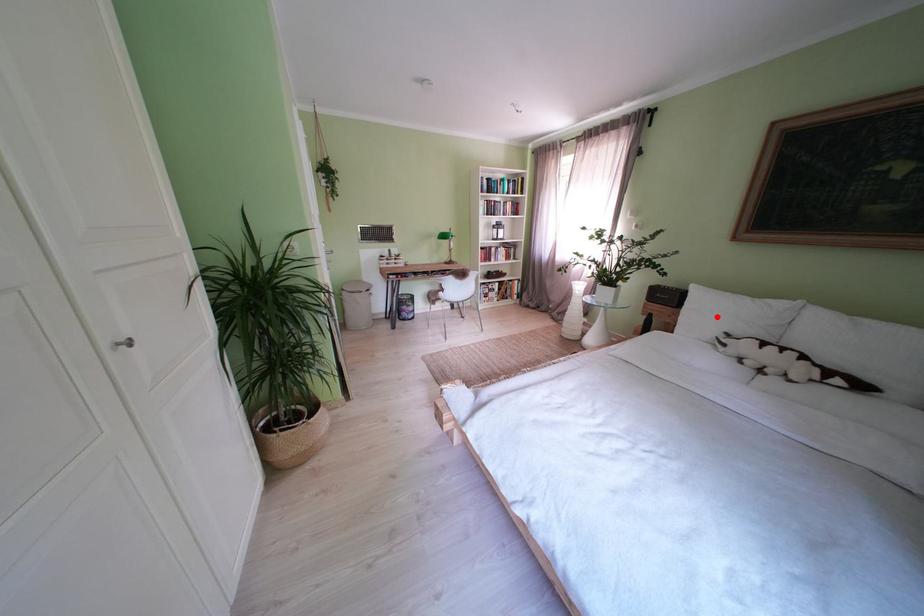
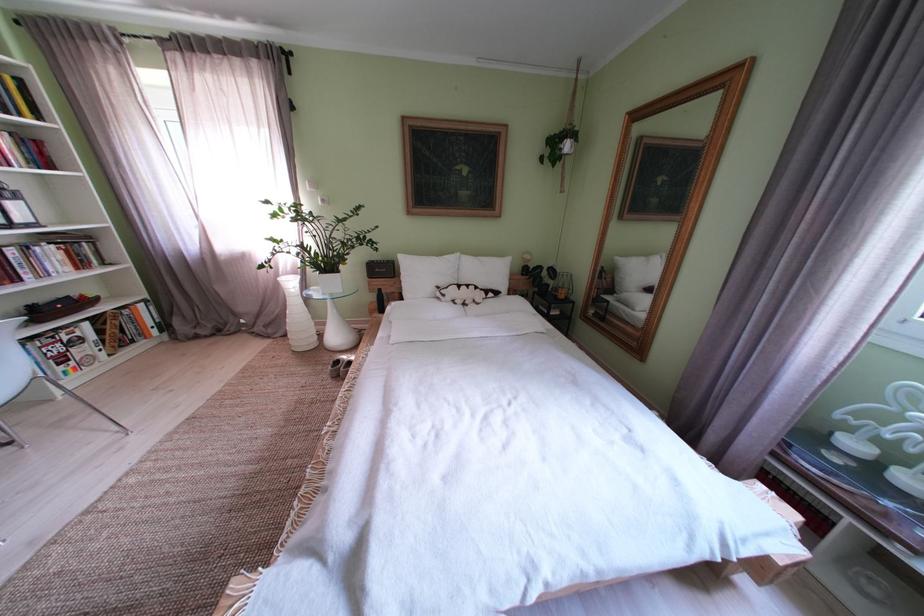
The point at the highlighted location is marked in the first image. Where is the corresponding point in the second image?

(429, 280)